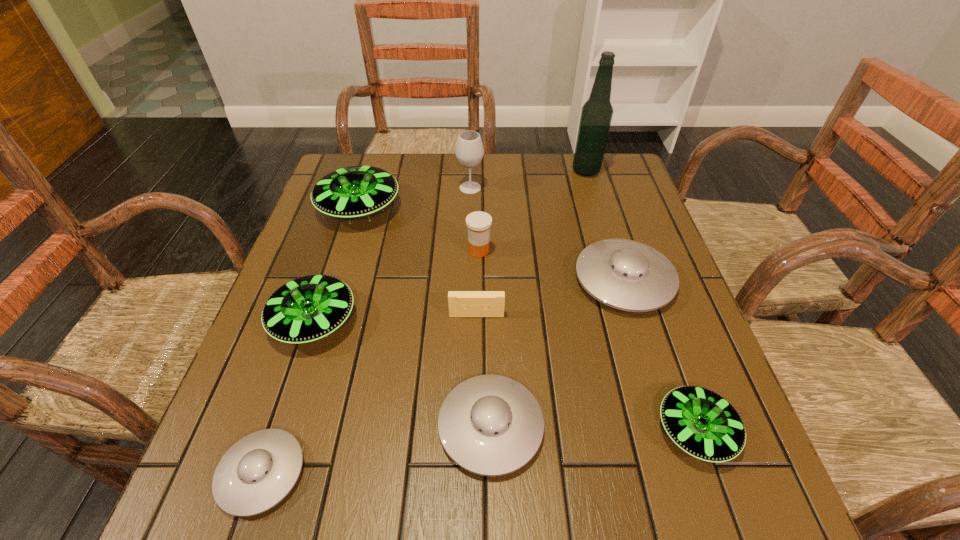
Locate an element on the screen. The width and height of the screenshot is (960, 540). vacant space located on the label of the medicine is located at coordinates (613, 251).

Find the location of a particular element. vacant area situated on the front of the second tallest saucer is located at coordinates (278, 430).

Locate an element on the screen. free space located on the front of the farthest gray saucer is located at coordinates (697, 514).

Identify the location of vacant region located 0.320m on the back of the nearest green saucer. This screenshot has width=960, height=540. (639, 272).

Where is `blank space located at the front of the videotape with spools`? blank space located at the front of the videotape with spools is located at coordinates (476, 350).

Locate an element on the screen. vacant space located 0.350m on the back of the second gray saucer from left to right is located at coordinates (488, 254).

Find the location of `vacant space positioned on the back of the shortest object`. vacant space positioned on the back of the shortest object is located at coordinates (328, 275).

Locate an element on the screen. The width and height of the screenshot is (960, 540). alcohol situated at the far edge is located at coordinates (596, 115).

I want to click on wineglass that is at the far edge, so click(469, 151).

Image resolution: width=960 pixels, height=540 pixels. Identify the location of saucer that is at the far edge. [351, 192].